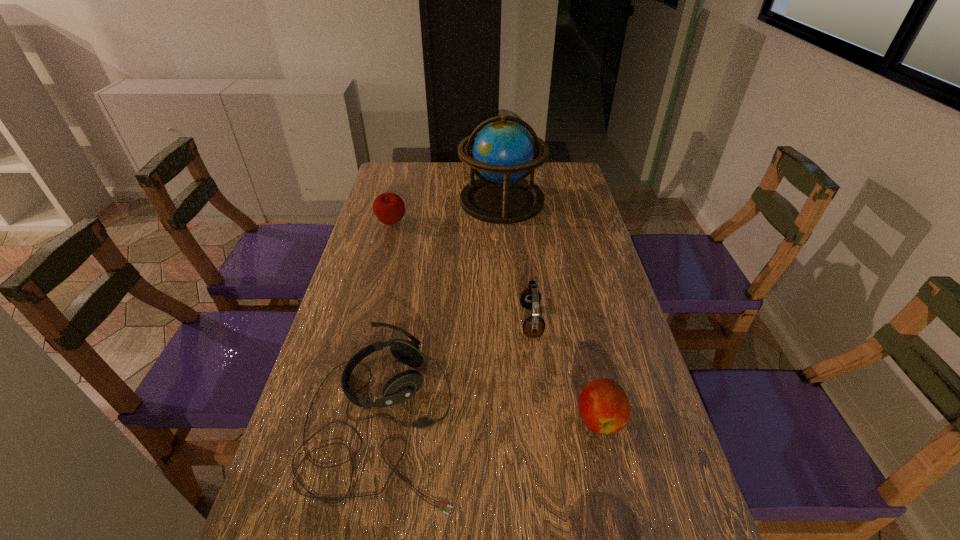
Find the location of a particular element. vacant space at the far edge of the desktop is located at coordinates (451, 184).

Locate an element on the screen. This screenshot has height=540, width=960. vacant space at the left edge of the desktop is located at coordinates (361, 418).

This screenshot has width=960, height=540. Identify the location of free space at the right edge of the desktop. (609, 294).

Locate an element on the screen. vacant space at the far left corner is located at coordinates (408, 191).

Image resolution: width=960 pixels, height=540 pixels. I want to click on vacant space that's between the third farthest object and the right apple, so click(565, 370).

This screenshot has width=960, height=540. Identify the location of unoccupied area between the farther apple and the tallest object. (446, 212).

Point out which object is positioned as the third nearest to the right headset. Please provide its 2D coordinates. Your answer should be formatted as a tuple, i.e. [(x, y)], where the tuple contains the x and y coordinates of a point satisfying the conditions above.

[(503, 153)]

Select which object appears as the third closest to the farther apple. Please provide its 2D coordinates. Your answer should be formatted as a tuple, i.e. [(x, y)], where the tuple contains the x and y coordinates of a point satisfying the conditions above.

[(402, 386)]

The image size is (960, 540). Find the location of `vacant space that satisfies the following two spatial constraints: 1. on the outer surface of the left headset; 2. on the left side of the right apple`. vacant space that satisfies the following two spatial constraints: 1. on the outer surface of the left headset; 2. on the left side of the right apple is located at coordinates (382, 418).

Where is `free space that satisfies the following two spatial constraints: 1. on the back side of the right apple; 2. on the ear cups of the third farthest object`? The width and height of the screenshot is (960, 540). free space that satisfies the following two spatial constraints: 1. on the back side of the right apple; 2. on the ear cups of the third farthest object is located at coordinates (577, 321).